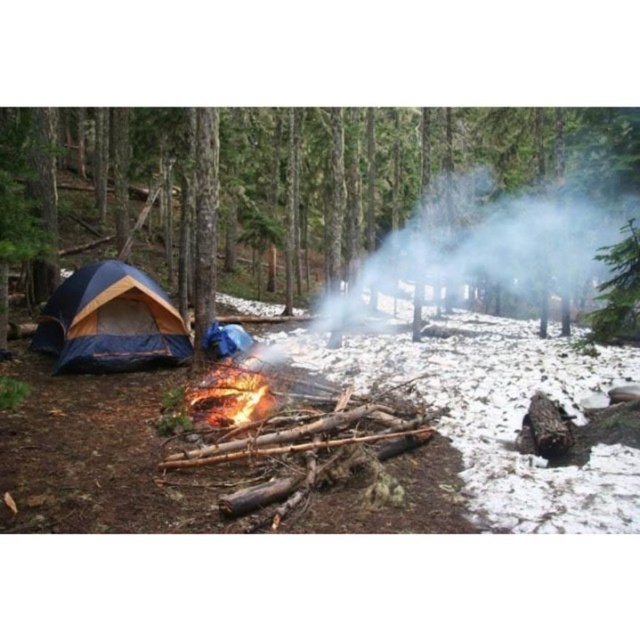
Question: Which object appears farthest from the camera in this image?

Choices:
 (A) blue fabric tent at left
 (B) flaming wood at center
 (C) blue tarpaulin tent at left

Answer: (C)

Question: Which point appears closest to the camera in this image?

Choices:
 (A) (180, 332)
 (B) (508, 122)
 (C) (234, 385)

Answer: (C)

Question: Can you confirm if blue tarpaulin tent at left is positioned to the right of flaming wood at center?

Choices:
 (A) no
 (B) yes

Answer: (A)

Question: Does blue fabric tent at left appear on the right side of flaming wood at center?

Choices:
 (A) yes
 (B) no

Answer: (A)

Question: Which of the following is the closest to the observer?

Choices:
 (A) flaming wood at center
 (B) blue fabric tent at left
 (C) blue tarpaulin tent at left

Answer: (B)

Question: Can you confirm if blue fabric tent at left is positioned to the left of flaming wood at center?

Choices:
 (A) yes
 (B) no

Answer: (B)